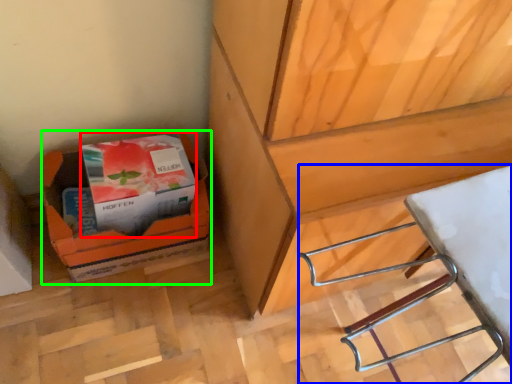
Question: Based on their relative distances, which object is farther from paperback book (highlighted by a red box)? Choose from wood (highlighted by a blue box) and cardboard box (highlighted by a green box).

Choices:
 (A) wood
 (B) cardboard box

Answer: (A)